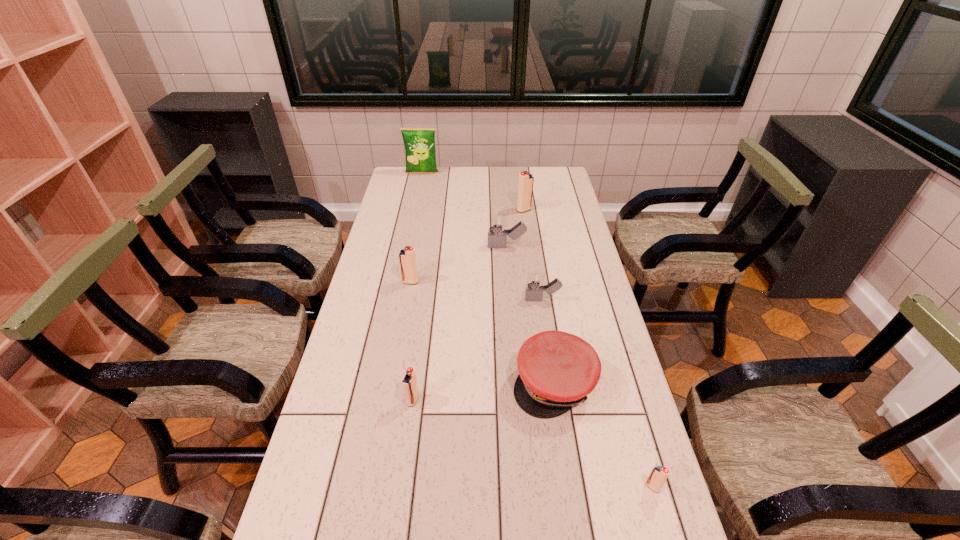
The width and height of the screenshot is (960, 540). Identify the location of the third nearest igniter. (409, 382).

Where is `the third red igniter from right to left`? the third red igniter from right to left is located at coordinates (409, 382).

Identify the location of red cap. The height and width of the screenshot is (540, 960). (557, 370).

The image size is (960, 540). Find the location of `the rightmost object`. the rightmost object is located at coordinates (659, 474).

At what (x,y) coordinates should I click in order to perform the action: click on the smallest red igniter. Please return your answer as a coordinate pair (x, y). Looking at the image, I should click on (659, 474).

Where is `free space located 0.220m on the front-facing side of the crisp (potato chip)`? The height and width of the screenshot is (540, 960). free space located 0.220m on the front-facing side of the crisp (potato chip) is located at coordinates (417, 201).

The image size is (960, 540). I want to click on free space located on the back of the farthest igniter, so click(x=520, y=184).

Identify the location of vacant space located on the right of the leftmost igniter. (436, 282).

Locate an element on the screen. The height and width of the screenshot is (540, 960). free spot located 0.330m on the left of the sixth nearest igniter is located at coordinates (400, 247).

What are the coordinates of `vacant space situated 0.360m on the front of the fourth nearest igniter` in the screenshot? It's located at (559, 403).